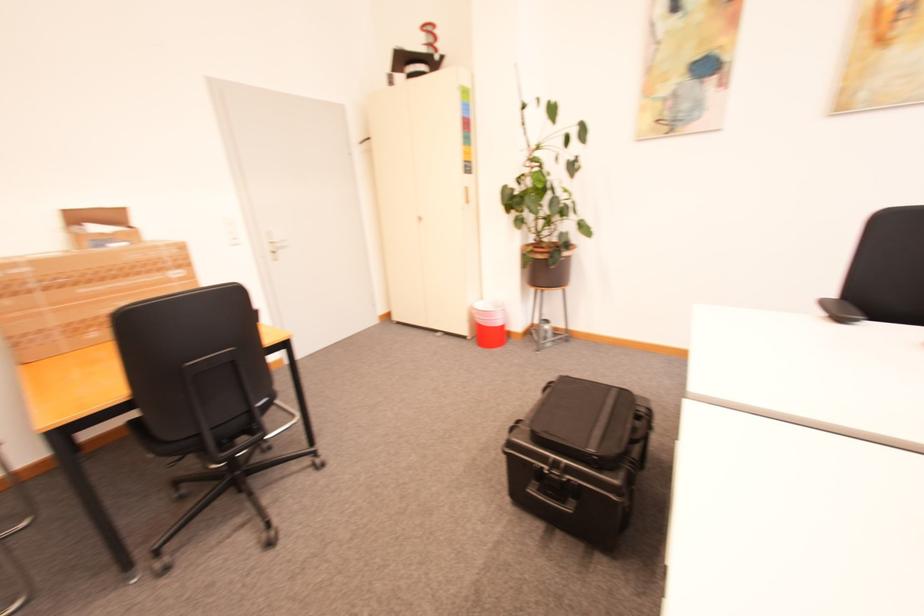
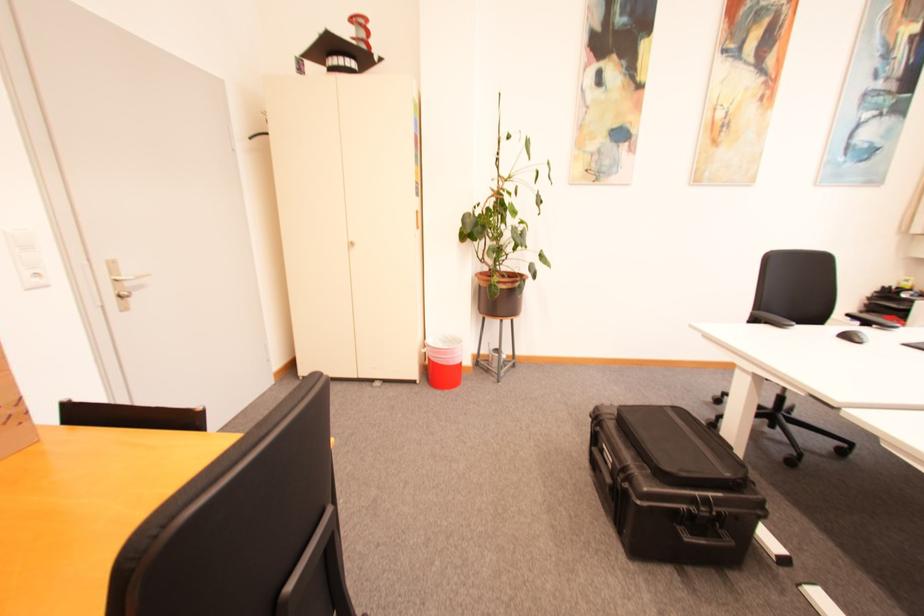
The point at (480, 312) is marked in the first image. Where is the corresponding point in the second image?

(431, 351)